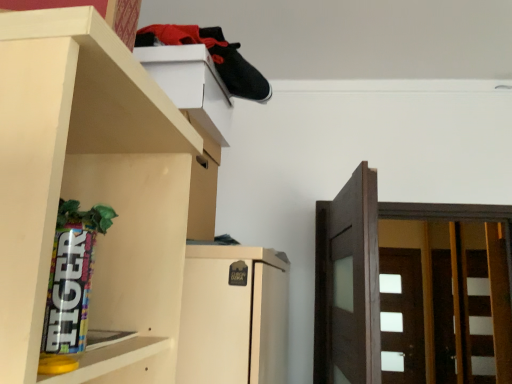
Question: Is point (407, 357) positioned closer to the camera than point (160, 67)?

Choices:
 (A) closer
 (B) farther

Answer: (B)

Question: From a real-world perspective, is white glossy door at right, arranged as the first door when ordered from the bottom, positioned above or below white matte cabinet at upper center?

Choices:
 (A) above
 (B) below

Answer: (B)

Question: Which is farther from the white matte cabinet at upper center?

Choices:
 (A) white glossy door at right, marked as the 2th door in a top-to-bottom arrangement
 (B) dark brown wood door at right, placed as the first door when sorted from top to bottom

Answer: (A)

Question: Which is nearer to the dark brown wood door at right, placed as the first door when sorted from top to bottom?

Choices:
 (A) white glossy door at right, which is the 1th door in back-to-front order
 (B) white matte cabinet at upper center

Answer: (B)